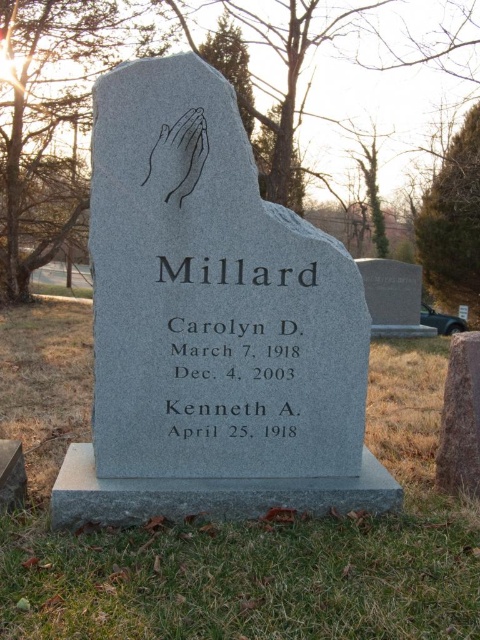
Can you confirm if gray granite gravestone at lower right is positioned to the left of black matte hands at center?

Incorrect, gray granite gravestone at lower right is not on the left side of black matte hands at center.

Can you confirm if gray granite gravestone at lower right is positioned below black matte hands at center?

Correct, gray granite gravestone at lower right is located below black matte hands at center.

Is point (455, 408) positioned in front of point (204, 136)?

That is False.

The width and height of the screenshot is (480, 640). What are the coordinates of `gray granite gravestone at lower right` in the screenshot? It's located at (460, 419).

Who is positioned more to the left, gray granite monument at center or gray granite gravestone at lower right?

Positioned to the left is gray granite monument at center.

Which is in front, point (247, 472) or point (458, 387)?

Point (247, 472) is more forward.

Which is in front, point (173, 397) or point (477, 436)?

Point (173, 397) is in front.

Where is `gray granite monument at center`? The height and width of the screenshot is (640, 480). gray granite monument at center is located at coordinates (213, 330).

What do you see at coordinates (213, 330) in the screenshot?
I see `gray granite monument at center` at bounding box center [213, 330].

The height and width of the screenshot is (640, 480). What do you see at coordinates (213, 330) in the screenshot?
I see `gray granite monument at center` at bounding box center [213, 330].

Find the location of `gray granite monument at center`. gray granite monument at center is located at coordinates (213, 330).